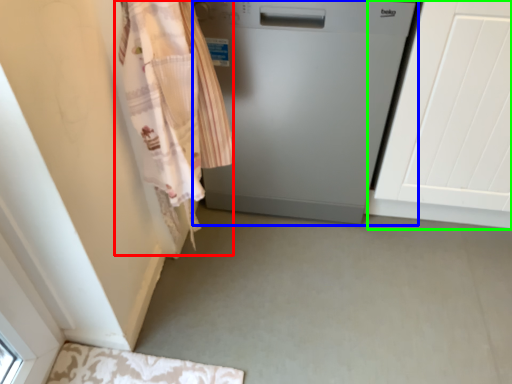
Question: Which object is positioned farthest from clothing (highlighted by a red box)? Select from home appliance (highlighted by a blue box) and screen door (highlighted by a green box).

Choices:
 (A) home appliance
 (B) screen door

Answer: (B)